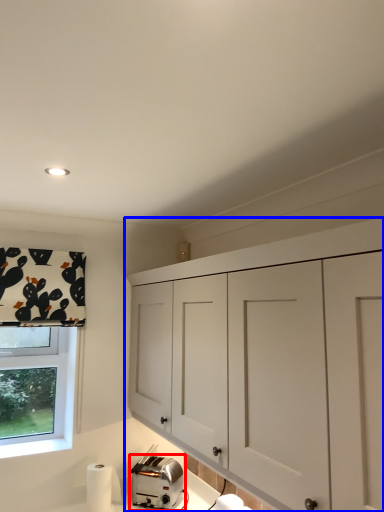
Question: Which object appears farthest to the camera in this image, toaster (highlighted by a red box) or cabinetry (highlighted by a blue box)?

Choices:
 (A) toaster
 (B) cabinetry

Answer: (A)